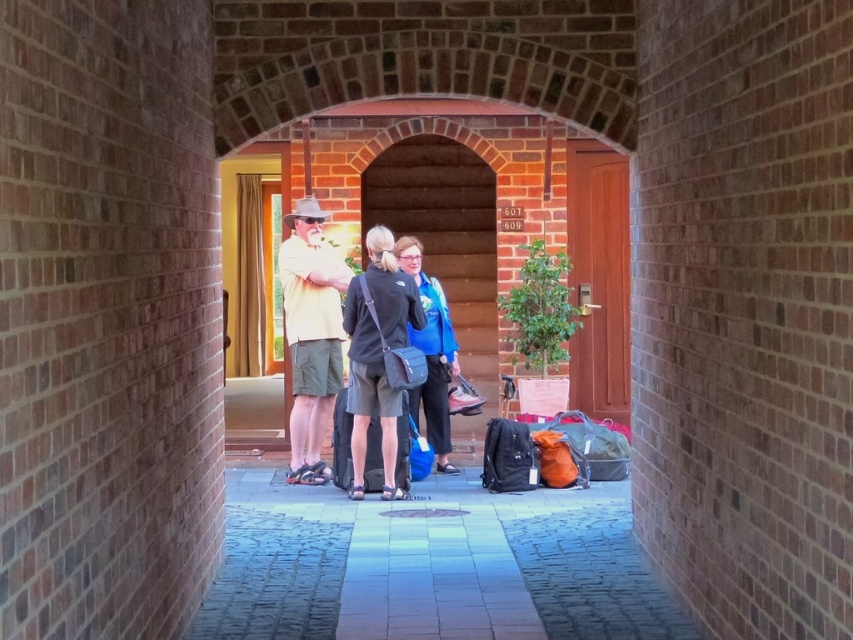
Is point (306, 208) farther from camera compared to point (380, 248)?

Yes, it is.

Identify the location of light yellow cotton shirt at center. This screenshot has height=640, width=853. (311, 336).

The width and height of the screenshot is (853, 640). Describe the element at coordinates (311, 336) in the screenshot. I see `light yellow cotton shirt at center` at that location.

Is light yellow cotton shirt at center below blue fabric backpack at center?

Actually, light yellow cotton shirt at center is above blue fabric backpack at center.

Find the location of a particular element. The height and width of the screenshot is (640, 853). light yellow cotton shirt at center is located at coordinates (311, 336).

Between black fabric backpack at center and blue fabric backpack at center, which one is positioned higher?

black fabric backpack at center is higher up.

Identify the location of black fabric backpack at center. This screenshot has width=853, height=640. (376, 353).

Which is behind, point (387, 346) or point (438, 406)?

The point (438, 406) is behind.

Locate an element on the screen. The width and height of the screenshot is (853, 640). black fabric backpack at center is located at coordinates (376, 353).